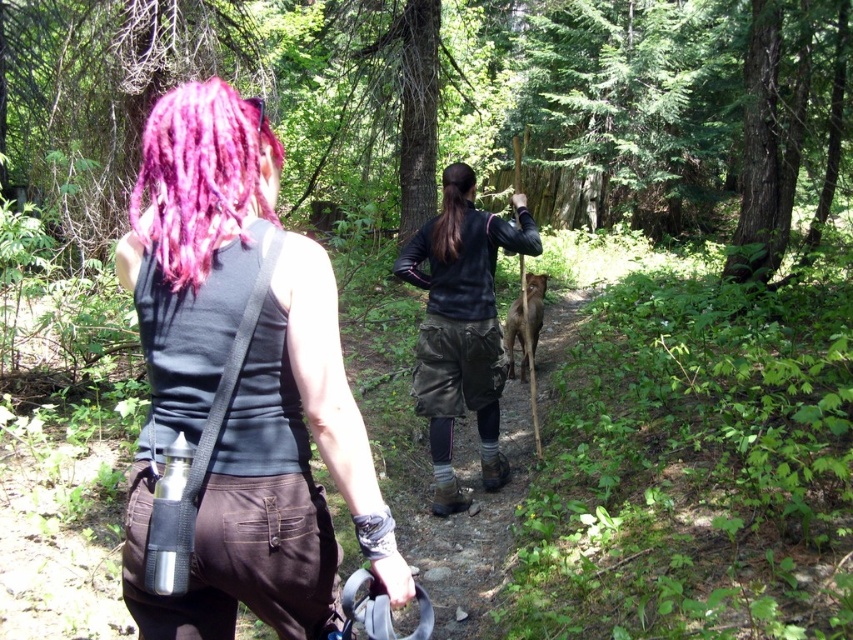
Consider the image. Can you confirm if dark gray leather jacket at center is wider than black silky hair at center?

Indeed, dark gray leather jacket at center has a greater width compared to black silky hair at center.

Is point (416, 348) closer to camera compared to point (451, 248)?

That is False.

Locate an element on the screen. The image size is (853, 640). dark gray leather jacket at center is located at coordinates (461, 326).

Is matte black tank top at upper left above pink dreadlocks at upper left?

Actually, matte black tank top at upper left is below pink dreadlocks at upper left.

Does matte black tank top at upper left appear under pink dreadlocks at upper left?

Yes.

Does point (231, 625) come in front of point (235, 177)?

No, (231, 625) is behind (235, 177).

Where is `matte black tank top at upper left`? matte black tank top at upper left is located at coordinates (242, 381).

Does pink dreadlocks at upper left appear on the right side of black silky hair at center?

In fact, pink dreadlocks at upper left is to the left of black silky hair at center.

Which is behind, point (231, 104) or point (448, 170)?

The point (448, 170) is more distant.

Locate an element on the screen. Image resolution: width=853 pixels, height=640 pixels. pink dreadlocks at upper left is located at coordinates (200, 177).